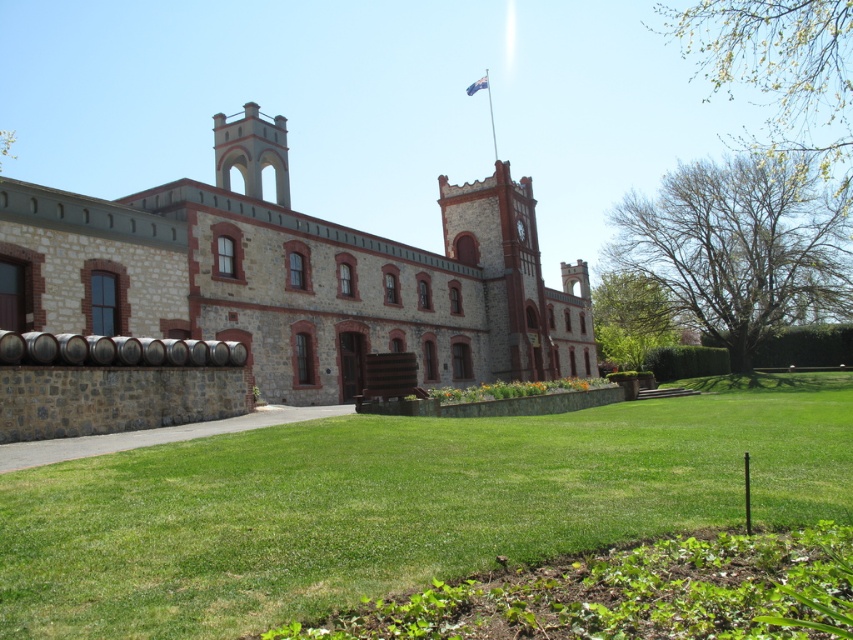
Can you confirm if green grass at center is wider than stone brick winery at center?

Incorrect, green grass at center's width does not surpass stone brick winery at center's.

Is green grass at center closer to the viewer compared to stone brick winery at center?

That is True.

Is point (51, 515) more distant than point (3, 404)?

That is False.

I want to click on green grass at center, so click(x=399, y=504).

Looking at this image, measure the distance from green grass at center to smooth stone tower at upper center.

They are 29.62 meters apart.

Measure the distance between green grass at center and smooth stone tower at upper center.

The distance of green grass at center from smooth stone tower at upper center is 29.62 meters.

Find the location of `green grass at center`. green grass at center is located at coordinates tap(399, 504).

Is stone brick winery at center further to the viewer compared to smooth stone tower at upper center?

That is False.

Where is `stone brick winery at center`? stone brick winery at center is located at coordinates click(299, 284).

Find the location of a particular element. The height and width of the screenshot is (640, 853). stone brick winery at center is located at coordinates (299, 284).